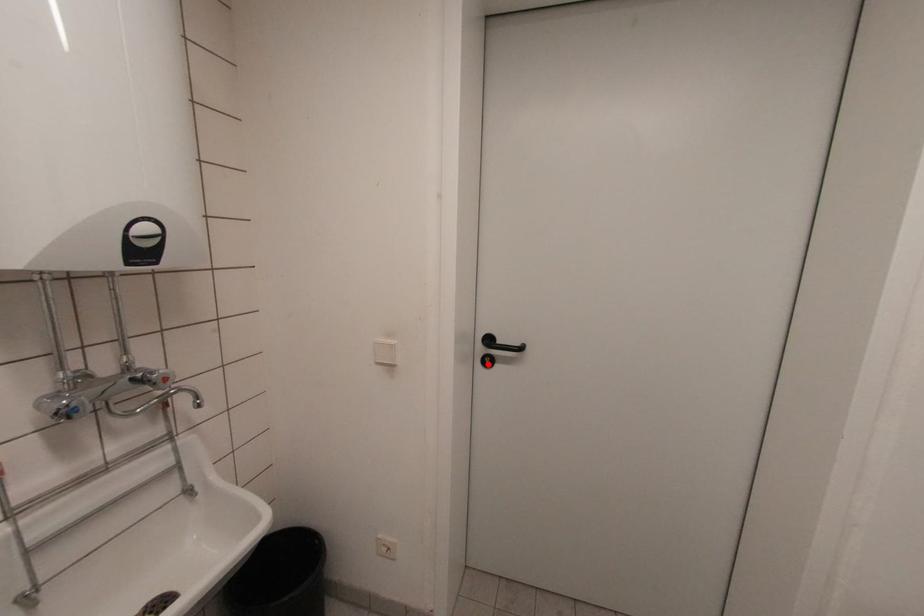
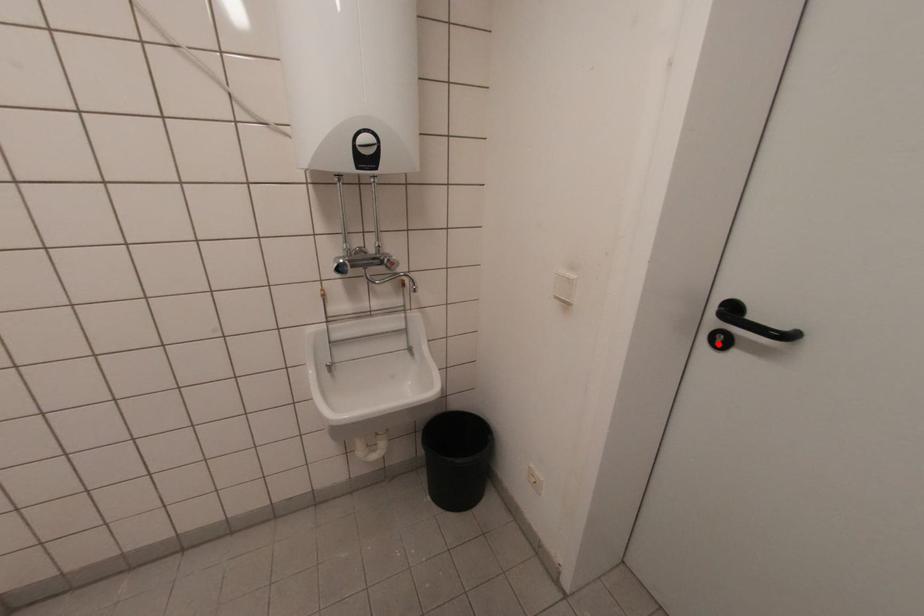
I am providing you with two images of the same scene from different viewpoints. A red point is marked on the first image and another point is marked on the second image. Is the marked point in image1 the same physical position as the marked point in image2?

Yes